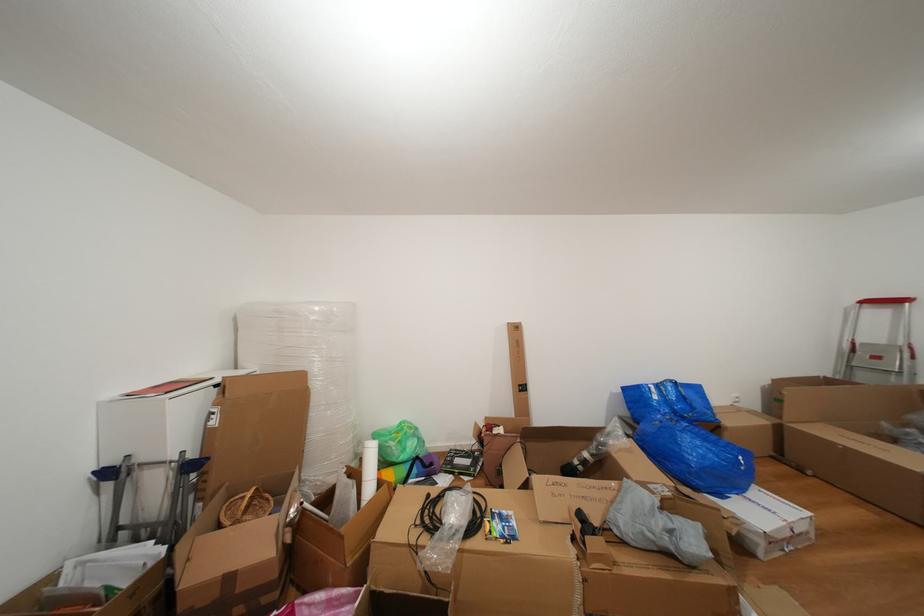
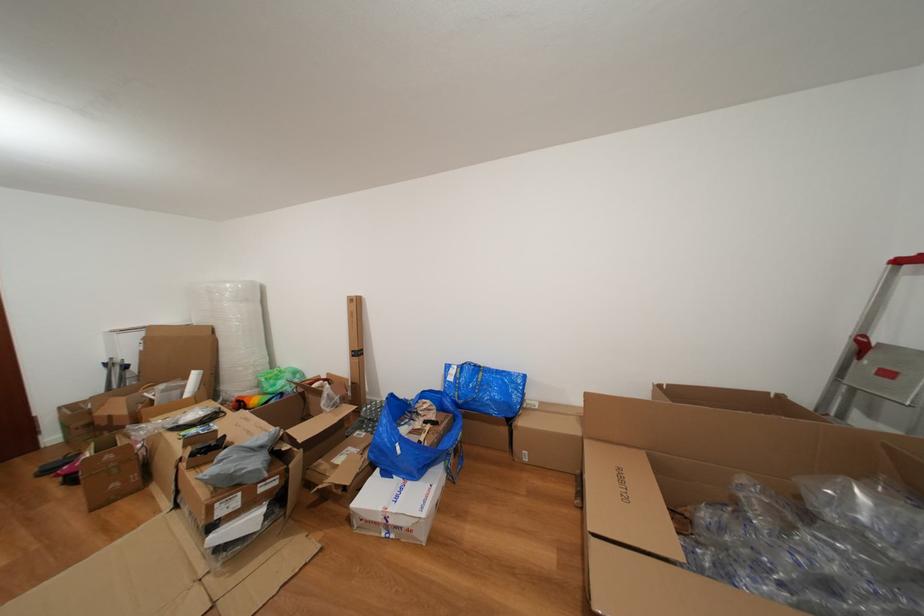
Locate, in the second image, the point that corresponds to point (894, 430) in the first image.

(750, 485)